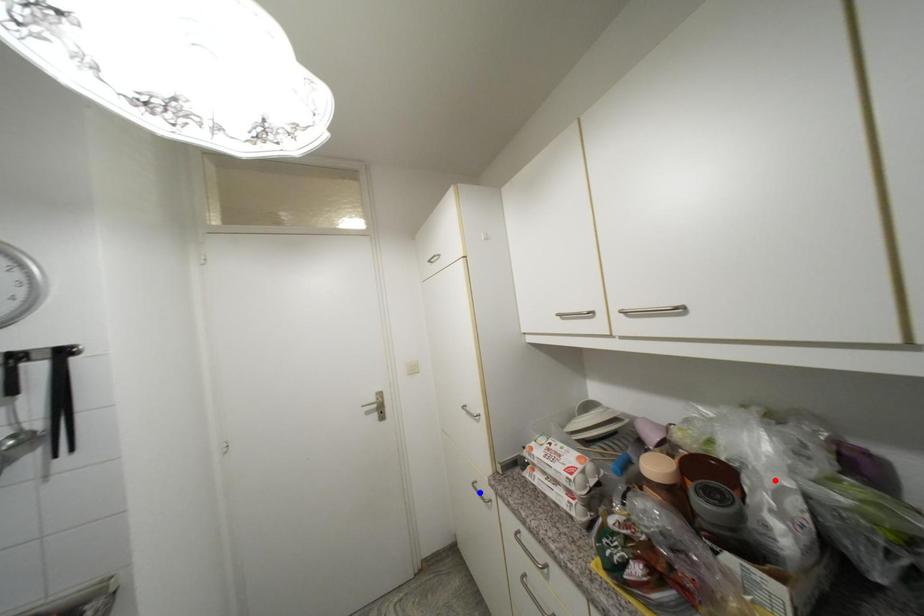
Question: Which of the two points in the image is closer to the camera?

Choices:
 (A) Blue point is closer.
 (B) Red point is closer.

Answer: (B)